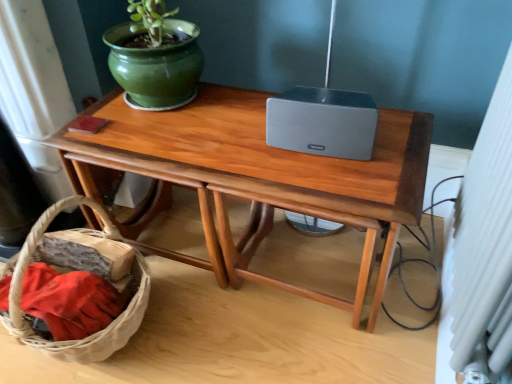
You are a GUI agent. You are given a task and a screenshot of the screen. Output one action in this format:
    pyautogui.click(x=<x>, y=<y>)
    Task: Click on the green glossy flowerpot at upper left
    The image size is (512, 384).
    Given the screenshot: What is the action you would take?
    pyautogui.click(x=156, y=65)

This screenshot has height=384, width=512. What do you see at coordinates (156, 65) in the screenshot? I see `green glossy flowerpot at upper left` at bounding box center [156, 65].

The height and width of the screenshot is (384, 512). Identify the location of wooden table at center. (255, 178).

Image resolution: width=512 pixels, height=384 pixels. In order to click on woven brown basket at lower left in this screenshot , I will do `click(93, 334)`.

At what (x,y) coordinates should I click in order to perform the action: click on green glossy flowerpot at upper left. Please return your answer as a coordinate pair (x, y). Looking at the image, I should click on (156, 65).

Considering the sizes of green glossy flowerpot at upper left and woven brown basket at lower left in the image, is green glossy flowerpot at upper left taller or shorter than woven brown basket at lower left?

In the image, green glossy flowerpot at upper left appears to be shorter than woven brown basket at lower left.

How much distance is there between green glossy flowerpot at upper left and woven brown basket at lower left?

19.17 inches.

Find the location of a particular element. The width and height of the screenshot is (512, 384). basket in front of the green glossy flowerpot at upper left is located at coordinates (93, 334).

Which of these two, green glossy flowerpot at upper left or woven brown basket at lower left, is bigger?

woven brown basket at lower left is bigger.

Considering the sizes of wooden table at center and green glossy flowerpot at upper left in the image, is wooden table at center wider or thinner than green glossy flowerpot at upper left?

Considering their sizes, wooden table at center looks broader than green glossy flowerpot at upper left.

From a real-world perspective, who is located higher, wooden table at center or green glossy flowerpot at upper left?

green glossy flowerpot at upper left, from a real-world perspective.

From the image's perspective, is wooden table at center below green glossy flowerpot at upper left?

Yes, from the image's perspective, wooden table at center is beneath green glossy flowerpot at upper left.

How different are the orientations of wooden table at center and green glossy flowerpot at upper left in degrees?

The angle between the facing direction of wooden table at center and the facing direction of green glossy flowerpot at upper left is 0.811 degrees.

Is green glossy flowerpot at upper left oriented towards wooden table at center?

No, green glossy flowerpot at upper left does not turn towards wooden table at center.

Is green glossy flowerpot at upper left in front of or behind wooden table at center in the image?

green glossy flowerpot at upper left is behind wooden table at center.

Between point (140, 70) and point (164, 162), which one is positioned in front?

The point (164, 162) is in front.

Is green glossy flowerpot at upper left far away from wooden table at center?

They are positioned close to each other.

Considering the sizes of objects woven brown basket at lower left and wooden table at center in the image provided, who is smaller, woven brown basket at lower left or wooden table at center?

woven brown basket at lower left.

In terms of width, does woven brown basket at lower left look wider or thinner when compared to wooden table at center?

In the image, woven brown basket at lower left appears to be more narrow than wooden table at center.

Can you confirm if woven brown basket at lower left is positioned to the right of wooden table at center?

In fact, woven brown basket at lower left is to the left of wooden table at center.

Is point (323, 173) less distant than point (2, 322)?

Yes, point (323, 173) is closer to viewer.

Is wooden table at center looking in the opposite direction of woven brown basket at lower left?

wooden table at center does not have its back to woven brown basket at lower left.

In the image, is wooden table at center positioned in front of or behind woven brown basket at lower left?

Visually, wooden table at center is located behind woven brown basket at lower left.

From a real-world perspective, which object stands above the other?

From a 3D spatial view, wooden table at center is above.

Can green glossy flowerpot at upper left be found inside woven brown basket at lower left?

No, green glossy flowerpot at upper left is located outside of woven brown basket at lower left.

From the image's perspective, who appears lower, woven brown basket at lower left or green glossy flowerpot at upper left?

woven brown basket at lower left is shown below in the image.

Between point (71, 349) and point (126, 52), which one is positioned in front?

The point (71, 349) is in front.

Considering the sizes of woven brown basket at lower left and green glossy flowerpot at upper left in the image, is woven brown basket at lower left wider or thinner than green glossy flowerpot at upper left?

woven brown basket at lower left is wider than green glossy flowerpot at upper left.

At what (x,y) coordinates should I click in order to perform the action: click on flowerpot above the woven brown basket at lower left (from a real-world perspective). Please return your answer as a coordinate pair (x, y). This screenshot has width=512, height=384. Looking at the image, I should click on (156, 65).

The image size is (512, 384). In order to click on flowerpot above the wooden table at center (from the image's perspective) in this screenshot , I will do `click(156, 65)`.

When comparing their distances from woven brown basket at lower left, does green glossy flowerpot at upper left or wooden table at center seem further?

The object further to woven brown basket at lower left is green glossy flowerpot at upper left.

Considering their positions, is woven brown basket at lower left positioned further to wooden table at center than green glossy flowerpot at upper left?

woven brown basket at lower left lies further to wooden table at center than the other object.

Looking at the image, which one is located closer to green glossy flowerpot at upper left, wooden table at center or woven brown basket at lower left?

The object closer to green glossy flowerpot at upper left is wooden table at center.

Based on their spatial positions, is wooden table at center or green glossy flowerpot at upper left closer to woven brown basket at lower left?

wooden table at center is closer to woven brown basket at lower left.

In the scene shown: When comparing their distances from green glossy flowerpot at upper left, does woven brown basket at lower left or wooden table at center seem closer?

The object closer to green glossy flowerpot at upper left is wooden table at center.

When comparing their distances from wooden table at center, does green glossy flowerpot at upper left or woven brown basket at lower left seem closer?

green glossy flowerpot at upper left lies closer to wooden table at center than the other object.

This screenshot has width=512, height=384. I want to click on table between green glossy flowerpot at upper left and woven brown basket at lower left in the up-down direction, so click(255, 178).